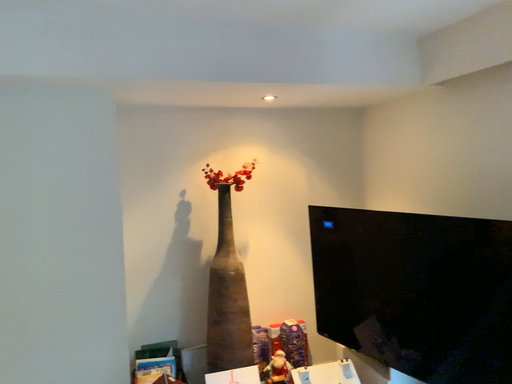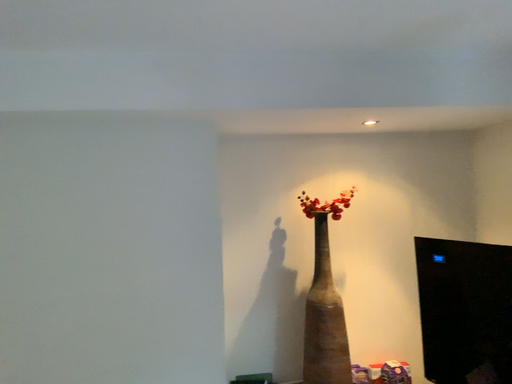
Question: Which way did the camera rotate in the video?

Choices:
 (A) rotated left
 (B) rotated right

Answer: (A)